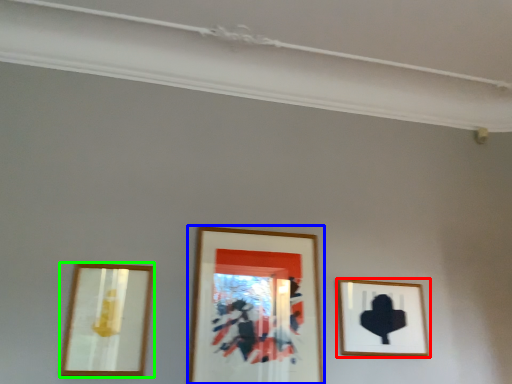
Question: Which object is positioned closest to picture frame (highlighted by a red box)? Select from picture frame (highlighted by a blue box) and picture frame (highlighted by a green box).

Choices:
 (A) picture frame
 (B) picture frame

Answer: (A)